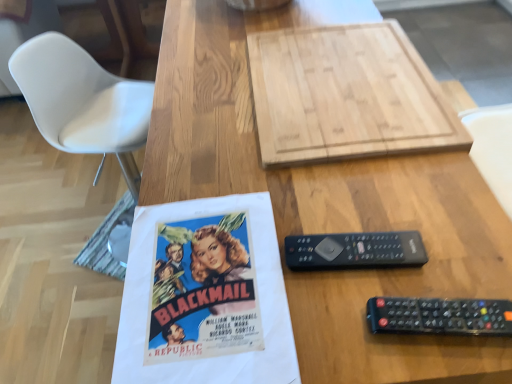
Question: Does black plastic remote at lower right turn towards natural wood cutting board at upper center?

Choices:
 (A) no
 (B) yes

Answer: (A)

Question: Is black plastic remote at lower right outside of natural wood cutting board at upper center?

Choices:
 (A) yes
 (B) no

Answer: (A)

Question: Considering the relative sizes of black plastic remote at lower right and natural wood cutting board at upper center in the image provided, is black plastic remote at lower right bigger than natural wood cutting board at upper center?

Choices:
 (A) no
 (B) yes

Answer: (A)

Question: From the image's perspective, is black plastic remote at lower right above natural wood cutting board at upper center?

Choices:
 (A) yes
 (B) no

Answer: (B)

Question: Does black plastic remote at lower right appear on the left side of natural wood cutting board at upper center?

Choices:
 (A) no
 (B) yes

Answer: (A)

Question: Does black plastic remote at lower right have a lesser height compared to natural wood cutting board at upper center?

Choices:
 (A) yes
 (B) no

Answer: (A)

Question: Would you say natural wood cutting board at upper center is outside black plastic remote at right?

Choices:
 (A) no
 (B) yes

Answer: (B)

Question: Can you see natural wood cutting board at upper center touching black plastic remote at right?

Choices:
 (A) no
 (B) yes

Answer: (A)

Question: From the image's perspective, is natural wood cutting board at upper center beneath black plastic remote at right?

Choices:
 (A) no
 (B) yes

Answer: (A)

Question: Is natural wood cutting board at upper center far from black plastic remote at right?

Choices:
 (A) no
 (B) yes

Answer: (A)

Question: Is natural wood cutting board at upper center oriented towards black plastic remote at right?

Choices:
 (A) yes
 (B) no

Answer: (B)

Question: Is natural wood cutting board at upper center taller than black plastic remote at right?

Choices:
 (A) no
 (B) yes

Answer: (B)

Question: Is black plastic remote at right next to natural wood cutting board at upper center?

Choices:
 (A) yes
 (B) no

Answer: (B)